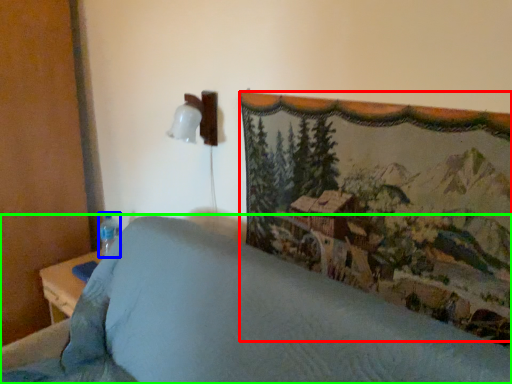
Question: Which object is positioned farthest from mountain landscape (highlighted by a red box)? Select from bottle (highlighted by a blue box) and furniture (highlighted by a green box).

Choices:
 (A) bottle
 (B) furniture

Answer: (A)